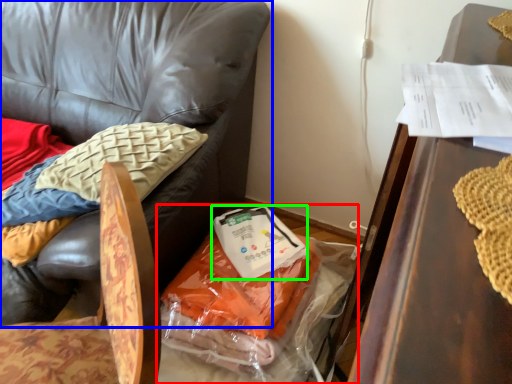
Question: Which is farther away from garbage (highlighted by a red box)? chair (highlighted by a blue box) or food (highlighted by a green box)?

Choices:
 (A) chair
 (B) food

Answer: (A)